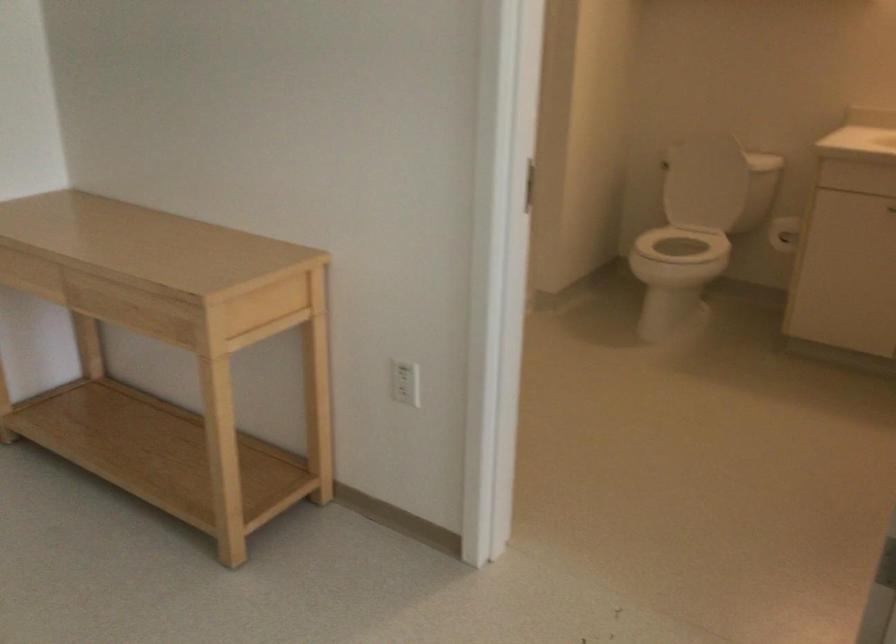
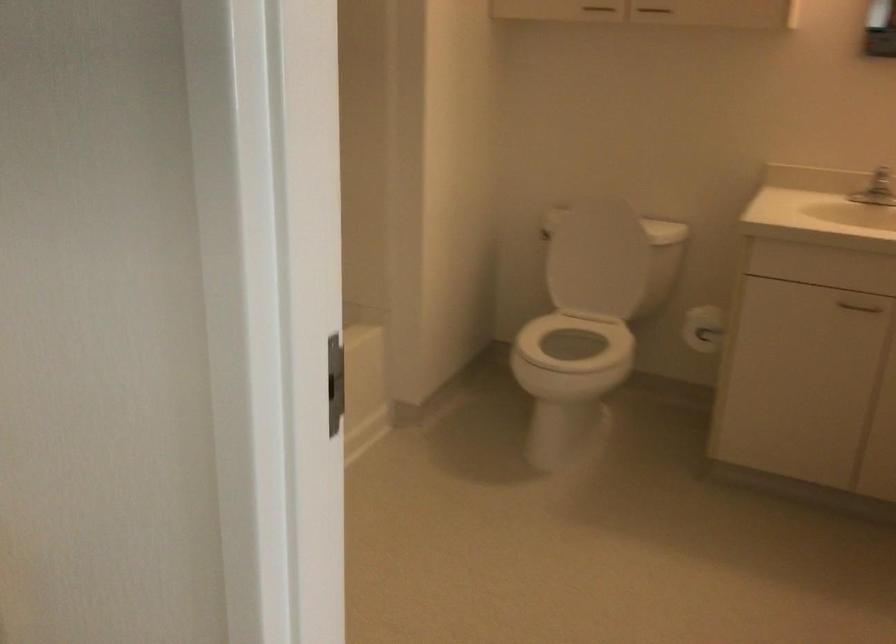
Where in the second image is the point corresponding to (x=796, y=223) from the first image?

(702, 328)